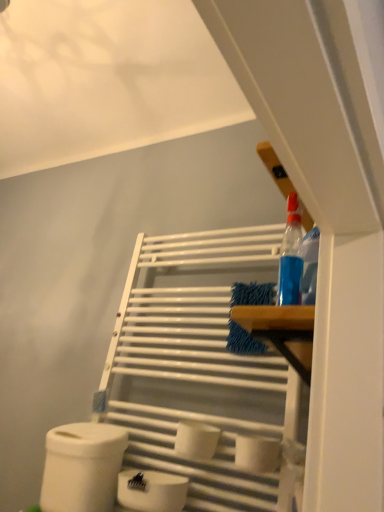
Question: Considering the positions of point (178, 441) and point (96, 437), is point (178, 441) closer or farther from the camera than point (96, 437)?

Choices:
 (A) farther
 (B) closer

Answer: (B)

Question: From their relative heights in the image, would you say white matte toilet paper at center, which is counted as the second toilet paper, starting from the right, is taller or shorter than white matte toilet paper at lower left, which is the 4th toilet paper from right to left?

Choices:
 (A) short
 (B) tall

Answer: (A)

Question: Which object is the closest to the blue microfiber cloth at center?

Choices:
 (A) white matte toilet paper at lower center, the 3th toilet paper in the right-to-left sequence
 (B) white matte toilet paper at center, which is counted as the second toilet paper, starting from the right
 (C) white matte towel rack at upper center
 (D) white matte toilet paper at center, which ranks as the 4th toilet paper in left-to-right order
 (E) white matte toilet paper at lower left, the 1th toilet paper viewed from the left

Answer: (C)

Question: Based on their relative distances, which object is nearer to the white matte toilet paper at center, which is counted as the second toilet paper, starting from the right?

Choices:
 (A) white matte toilet paper at center, which ranks as the 4th toilet paper in left-to-right order
 (B) white matte toilet paper at lower center, the 3th toilet paper in the right-to-left sequence
 (C) white matte towel rack at upper center
 (D) blue microfiber cloth at center
 (E) white matte toilet paper at lower left, the 1th toilet paper viewed from the left

Answer: (A)